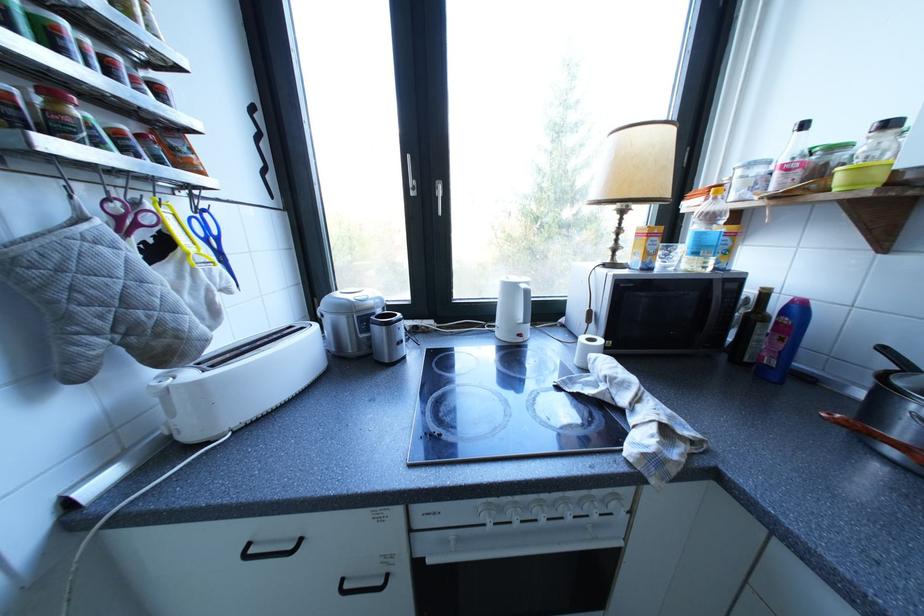
The height and width of the screenshot is (616, 924). What do you see at coordinates (784, 339) in the screenshot? I see `the blue plastic bottle` at bounding box center [784, 339].